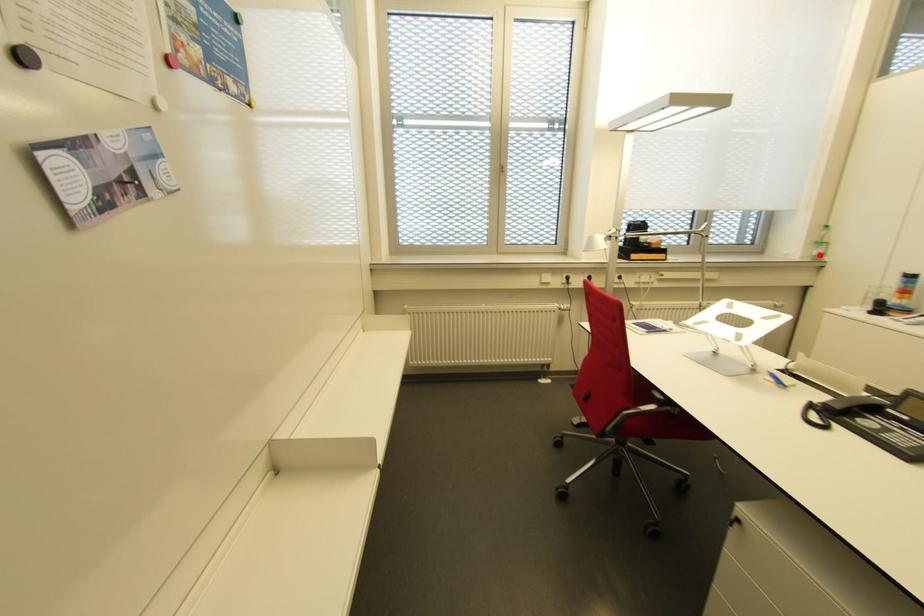
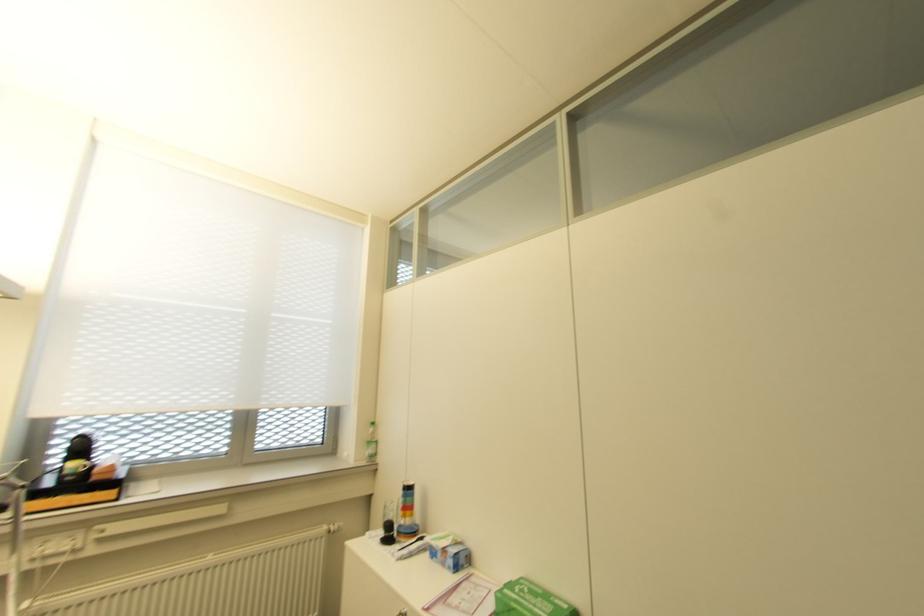
Question: I am providing you with two images of the same scene from different viewpoints. In image1, a red point is highlighted. Considering the same 3D point in image2, which of the following is correct?

Choices:
 (A) It is closer
 (B) It is farther

Answer: (B)